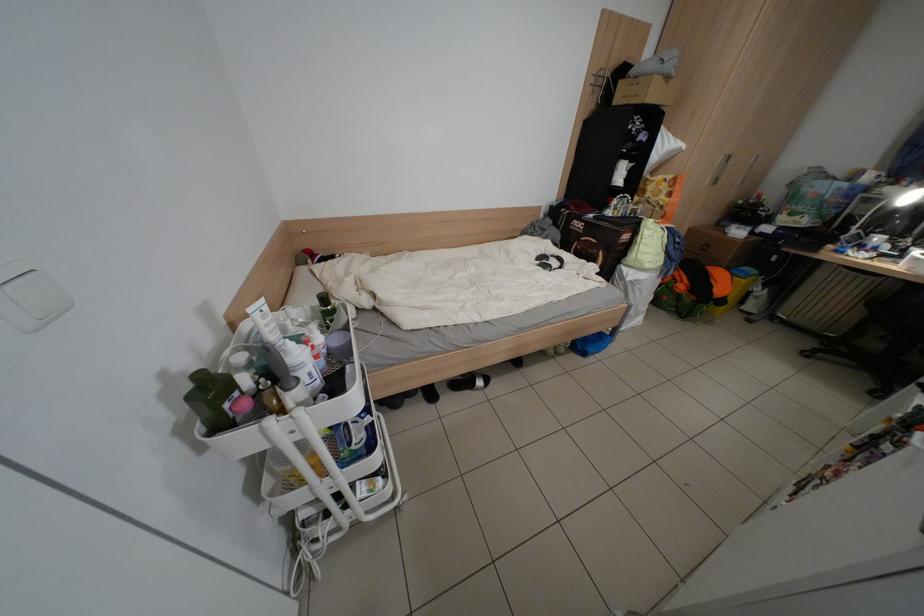
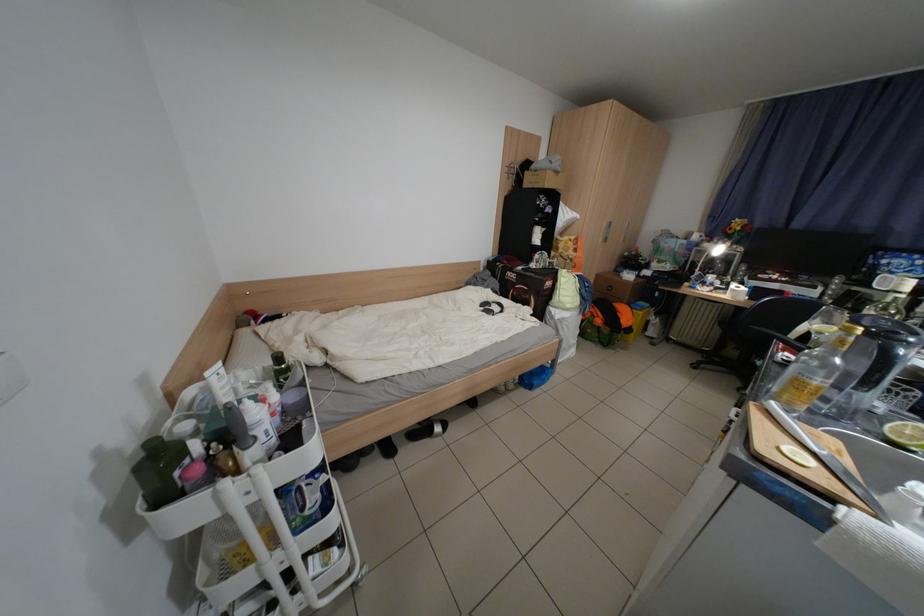
Question: Which direction would the cameraman need to move to produce the second image? Reply with the corresponding letter.

Choices:
 (A) Left
 (B) Right
 (C) Forward
 (D) Backward

Answer: (D)